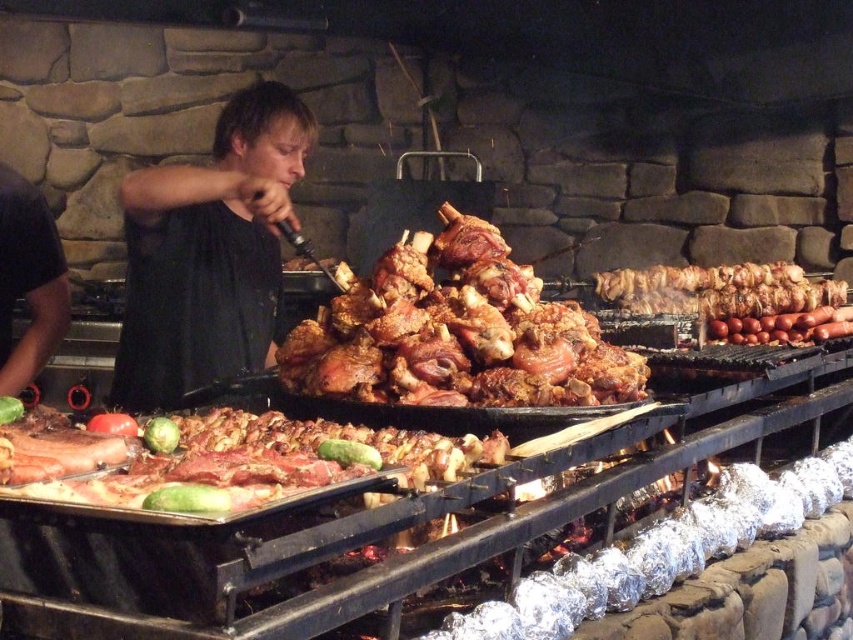
Question: Does brown crispy bone-in meat at center appear over golden brown meat skewers at right?

Choices:
 (A) no
 (B) yes

Answer: (A)

Question: Which of the following is the closest to the observer?

Choices:
 (A) black matte shirt at center
 (B) brown crispy bone-in meat at center
 (C) raw meat at center
 (D) golden brown meat skewers at right

Answer: (C)

Question: Which of the following is the closest to the observer?

Choices:
 (A) (268, 339)
 (B) (722, 316)
 (C) (144, 460)
 (D) (358, 364)

Answer: (C)

Question: Is black matte shirt at center to the left of raw meat at center from the viewer's perspective?

Choices:
 (A) yes
 (B) no

Answer: (A)

Question: Which object is positioned farthest from the golden brown meat skewers at right?

Choices:
 (A) black matte shirt at center
 (B) brown crispy bone-in meat at center
 (C) raw meat at center

Answer: (C)

Question: From the image, what is the correct spatial relationship of black matte shirt at center in relation to raw meat at center?

Choices:
 (A) right
 (B) left

Answer: (B)